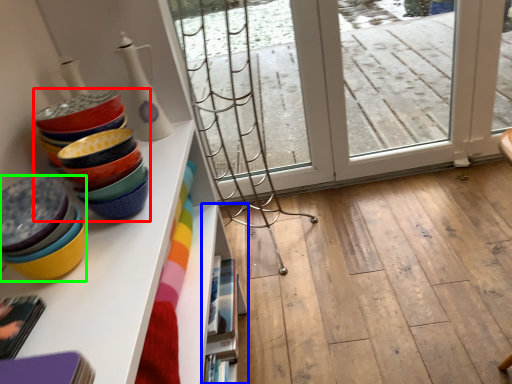
Question: Based on their relative distances, which object is farther from tableware (highlighted by a red box)? Choose from shelf (highlighted by a blue box) and table (highlighted by a green box).

Choices:
 (A) shelf
 (B) table

Answer: (A)